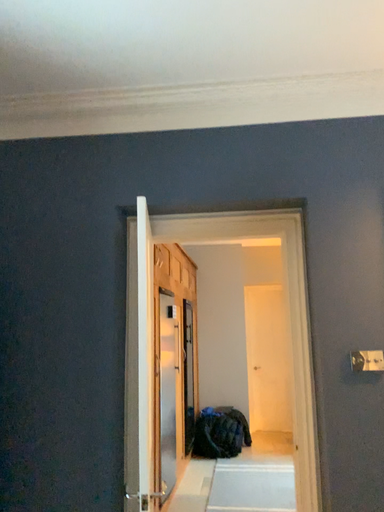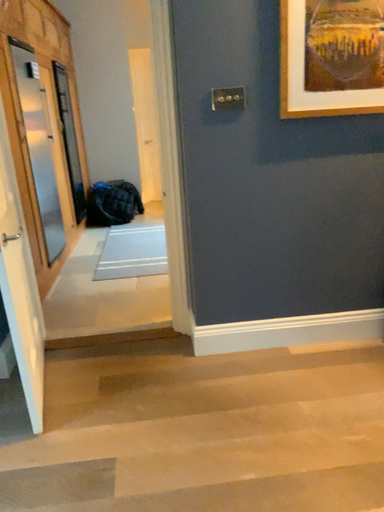
Question: Which way did the camera rotate in the video?

Choices:
 (A) rotated downward
 (B) rotated upward

Answer: (A)